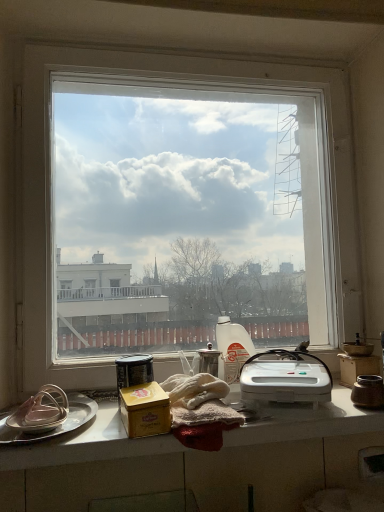
Question: Is white glossy countertop at lower center shorter than brown ceramic jar at right, the 6th appliance positioned from the left?

Choices:
 (A) no
 (B) yes

Answer: (B)

Question: Are white glossy countertop at lower center and brown ceramic jar at right, the 6th appliance positioned from the left, far apart?

Choices:
 (A) yes
 (B) no

Answer: (B)

Question: Is white glossy countertop at lower center in contact with brown ceramic jar at right, the 6th appliance positioned from the left?

Choices:
 (A) yes
 (B) no

Answer: (B)

Question: Is brown ceramic jar at right, the 1th appliance from the right, located within white glossy countertop at lower center?

Choices:
 (A) yes
 (B) no

Answer: (B)

Question: Is white glossy countertop at lower center at the right side of brown ceramic jar at right, the 6th appliance positioned from the left?

Choices:
 (A) yes
 (B) no

Answer: (B)

Question: Considering the relative positions of white glossy countertop at lower center and brown ceramic jar at right, the 6th appliance positioned from the left, in the image provided, is white glossy countertop at lower center to the left of brown ceramic jar at right, the 6th appliance positioned from the left, from the viewer's perspective?

Choices:
 (A) yes
 (B) no

Answer: (A)

Question: Is white glossy countertop at lower center shorter than white plastic sandwich maker at center?

Choices:
 (A) no
 (B) yes

Answer: (B)

Question: Is white glossy countertop at lower center looking in the opposite direction of white plastic sandwich maker at center?

Choices:
 (A) no
 (B) yes

Answer: (A)

Question: Can you confirm if white glossy countertop at lower center is positioned to the right of white plastic sandwich maker at center?

Choices:
 (A) yes
 (B) no

Answer: (B)

Question: From the image's perspective, is white glossy countertop at lower center on top of white plastic sandwich maker at center?

Choices:
 (A) no
 (B) yes

Answer: (A)

Question: From a real-world perspective, is white glossy countertop at lower center located higher than white plastic sandwich maker at center?

Choices:
 (A) no
 (B) yes

Answer: (A)

Question: Is white glossy countertop at lower center smaller than white plastic sandwich maker at center?

Choices:
 (A) no
 (B) yes

Answer: (A)

Question: Considering the relative sizes of transparent glass window at center and silver metallic platter at left in the image provided, is transparent glass window at center smaller than silver metallic platter at left?

Choices:
 (A) yes
 (B) no

Answer: (B)